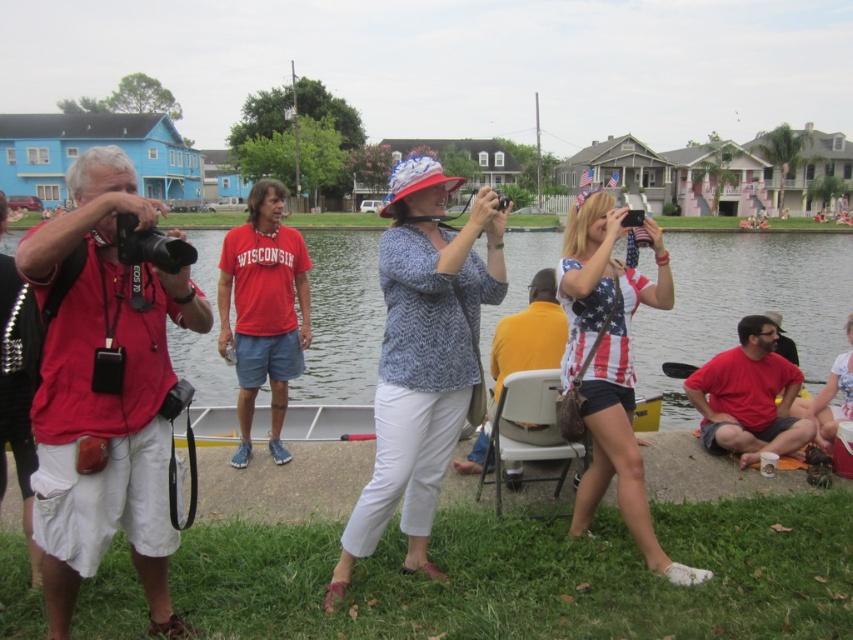
Is clear water at center to the left of red cotton shirt at lower right from the viewer's perspective?

Yes, clear water at center is to the left of red cotton shirt at lower right.

Is point (323, 378) farther from viewer compared to point (746, 346)?

Yes, it is.

Does point (662, 353) come closer to viewer compared to point (726, 422)?

No, it is not.

You are a GUI agent. You are given a task and a screenshot of the screen. Output one action in this format:
    pyautogui.click(x=<x>, y=<y>)
    Task: Click on the clear water at center
    
    Given the screenshot: What is the action you would take?
    pyautogui.click(x=743, y=304)

Does matte red shirt at left lie in front of red cotton shirt at center?

That is True.

In the scene shown: Can you confirm if matte red shirt at left is smaller than red cotton shirt at center?

Incorrect, matte red shirt at left is not smaller in size than red cotton shirt at center.

Consider the image. Who is more distant from viewer, [135,307] or [285,403]?

The point [285,403] is behind.

The image size is (853, 640). What are the coordinates of `matte red shirt at left` in the screenshot? It's located at (103, 392).

Does patterned fabric blouse at center have a greater height compared to red cotton shirt at lower right?

Indeed, patterned fabric blouse at center has a greater height compared to red cotton shirt at lower right.

Is point (428, 477) closer to viewer compared to point (790, 420)?

Yes, point (428, 477) is in front of point (790, 420).

Locate an element on the screen. patterned fabric blouse at center is located at coordinates (422, 356).